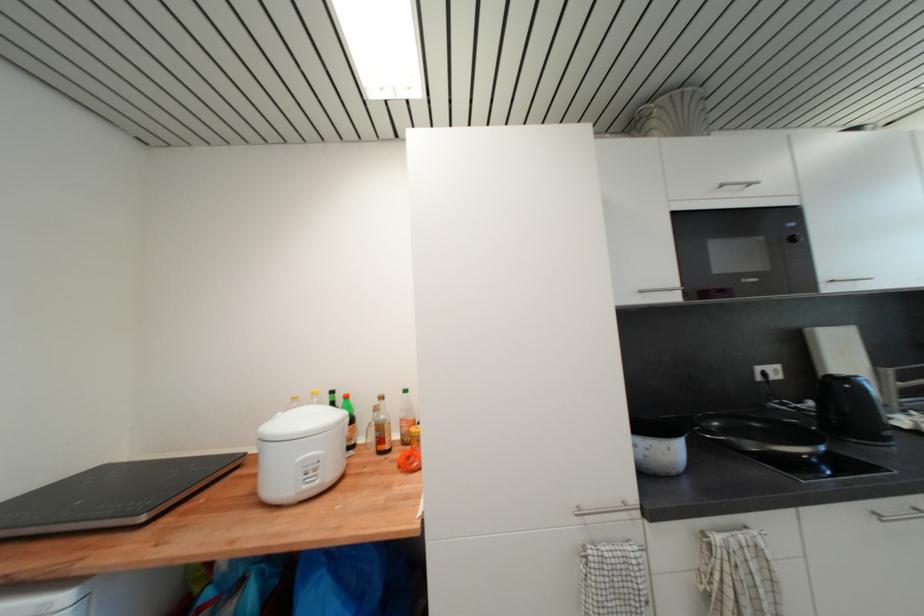
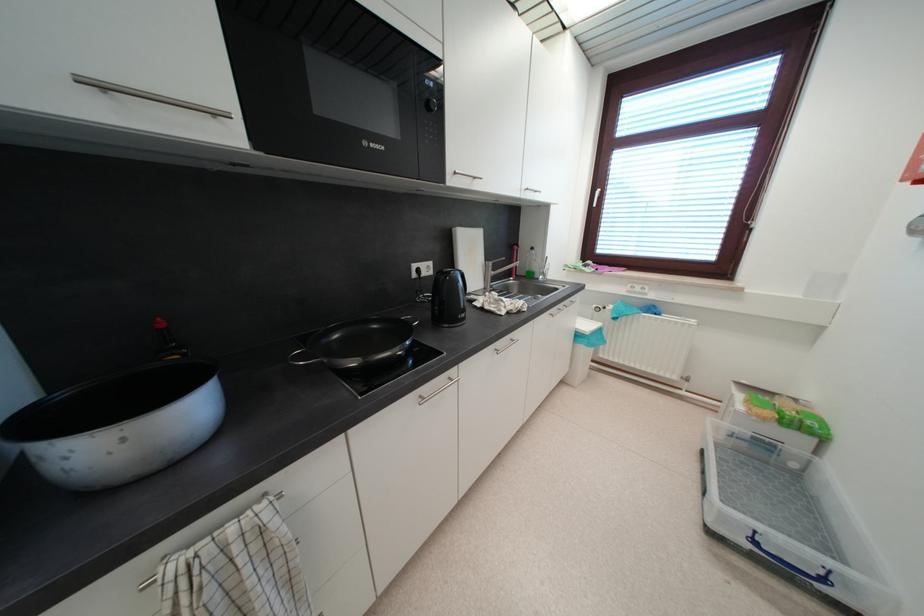
Locate, in the second image, the point that corresponds to [811,331] in the first image.

(458, 232)